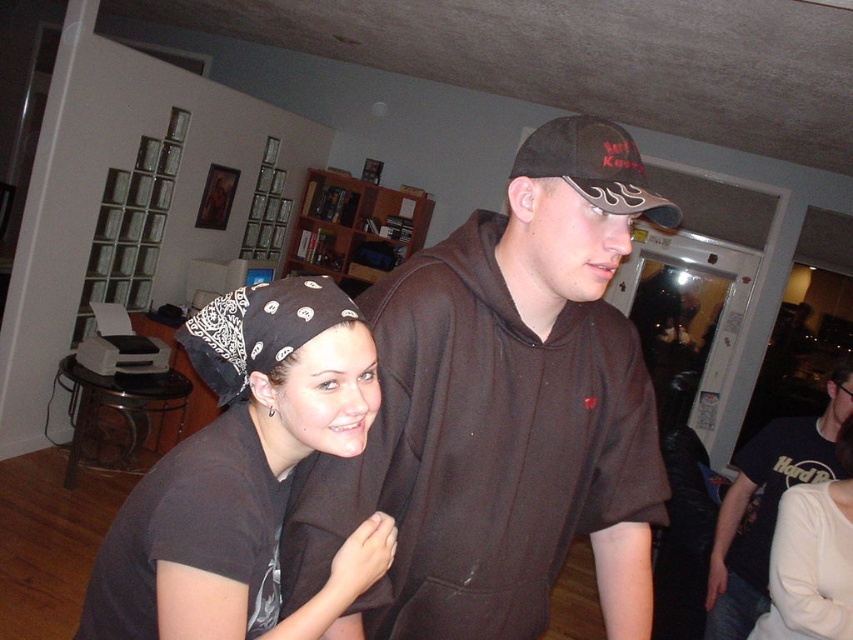
Question: Which of these objects is positioned closest to the black t-shirt at right?

Choices:
 (A) black bandana at upper left
 (B) brown hoodie at center

Answer: (B)

Question: Which object appears farthest from the camera in this image?

Choices:
 (A) brown hoodie at center
 (B) black bandana at upper left
 (C) black matte baseball cap at upper center

Answer: (C)

Question: Based on their relative distances, which object is nearer to the brown hoodie at center?

Choices:
 (A) black bandana at center
 (B) black t-shirt at right
 (C) black matte baseball cap at upper center
 (D) black bandana at upper left

Answer: (A)

Question: Can you confirm if black t-shirt at right is positioned to the right of black matte baseball cap at upper center?

Choices:
 (A) yes
 (B) no

Answer: (A)

Question: Does black bandana at center appear on the right side of black t-shirt at right?

Choices:
 (A) no
 (B) yes

Answer: (A)

Question: Does black bandana at center have a larger size compared to black matte baseball cap at upper center?

Choices:
 (A) no
 (B) yes

Answer: (B)